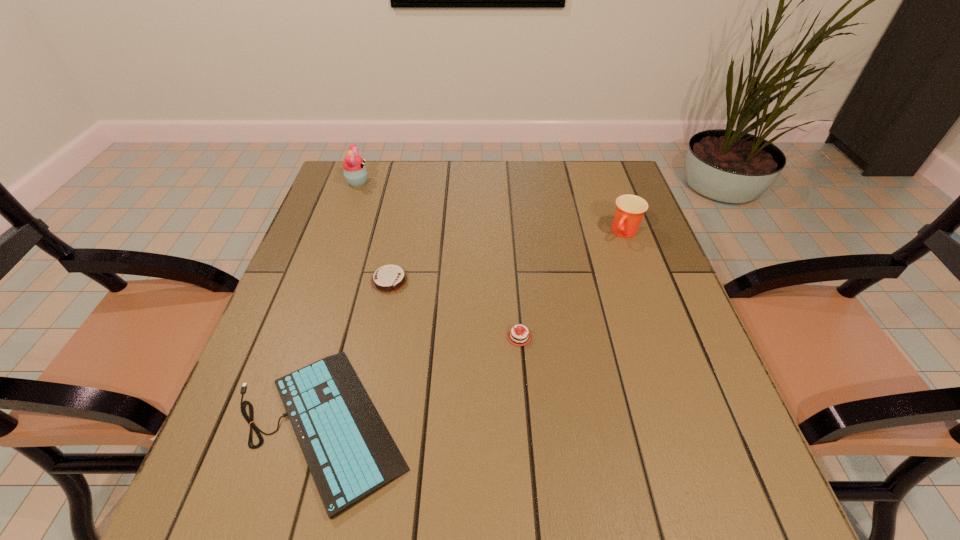
What are the coordinates of `vacant space that satisfies the following two spatial constraints: 1. on the face of the farthest object; 2. on the right side of the nearer chocolate cake` in the screenshot? It's located at (302, 337).

Image resolution: width=960 pixels, height=540 pixels. What are the coordinates of `blank space that satisfies the following two spatial constraints: 1. on the face of the farthest object; 2. on the back side of the left chocolate cake` in the screenshot? It's located at (323, 281).

I want to click on vacant space that satisfies the following two spatial constraints: 1. on the back side of the left chocolate cake; 2. on the left side of the cup, so click(399, 233).

You are a GUI agent. You are given a task and a screenshot of the screen. Output one action in this format:
    pyautogui.click(x=<x>, y=<y>)
    Task: Click on the vacant space that satisfies the following two spatial constraints: 1. on the face of the tallest object; 2. on the left side of the second farthest object
    
    Given the screenshot: What is the action you would take?
    pyautogui.click(x=340, y=233)

This screenshot has height=540, width=960. I want to click on free location that satisfies the following two spatial constraints: 1. on the back side of the computer keyboard; 2. on the right side of the rightmost object, so click(372, 233).